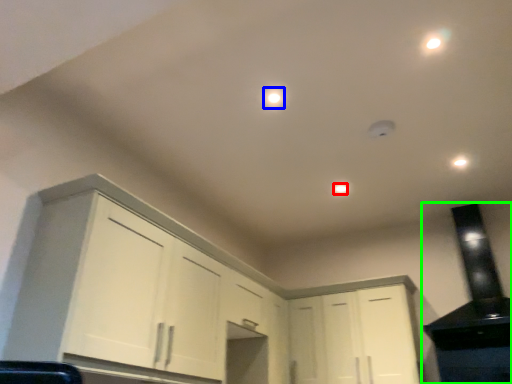
Question: Which is nearer to the dot (highlighted by a red box)? dot (highlighted by a blue box) or appliance (highlighted by a green box).

Choices:
 (A) dot
 (B) appliance

Answer: (A)